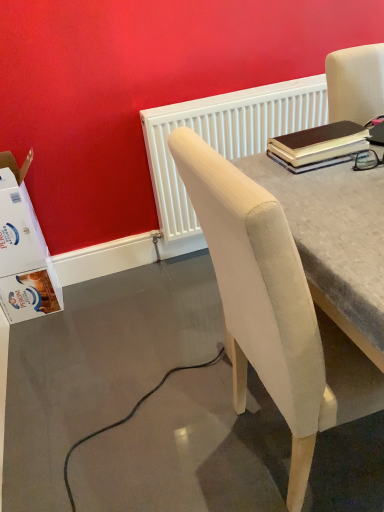
Question: Considering the relative positions of brown leather notebook at upper right and white cardboard box at lower left in the image provided, is brown leather notebook at upper right to the right of white cardboard box at lower left from the viewer's perspective?

Choices:
 (A) no
 (B) yes

Answer: (B)

Question: From the image's perspective, is brown leather notebook at upper right on white cardboard box at lower left?

Choices:
 (A) yes
 (B) no

Answer: (A)

Question: Is brown leather notebook at upper right looking in the opposite direction of white cardboard box at lower left?

Choices:
 (A) no
 (B) yes

Answer: (A)

Question: Is brown leather notebook at upper right closer to camera compared to white cardboard box at lower left?

Choices:
 (A) no
 (B) yes

Answer: (B)

Question: Are brown leather notebook at upper right and white cardboard box at lower left beside each other?

Choices:
 (A) no
 (B) yes

Answer: (A)

Question: From the image's perspective, would you say brown leather notebook at upper right is shown under white cardboard box at lower left?

Choices:
 (A) yes
 (B) no

Answer: (B)

Question: Does beige fabric chair at upper right lie in front of white cardboard box at lower left?

Choices:
 (A) yes
 (B) no

Answer: (A)

Question: Can you confirm if beige fabric chair at upper right is wider than white cardboard box at lower left?

Choices:
 (A) yes
 (B) no

Answer: (A)

Question: Does beige fabric chair at upper right come behind white cardboard box at lower left?

Choices:
 (A) no
 (B) yes

Answer: (A)

Question: Could you tell me if beige fabric chair at upper right is facing white cardboard box at lower left?

Choices:
 (A) no
 (B) yes

Answer: (A)

Question: Is beige fabric chair at upper right touching white cardboard box at lower left?

Choices:
 (A) no
 (B) yes

Answer: (A)

Question: Does beige fabric chair at upper right have a greater height compared to white cardboard box at lower left?

Choices:
 (A) yes
 (B) no

Answer: (A)

Question: Is white textured radiator at upper center smaller than beige fabric chair at upper right?

Choices:
 (A) yes
 (B) no

Answer: (A)